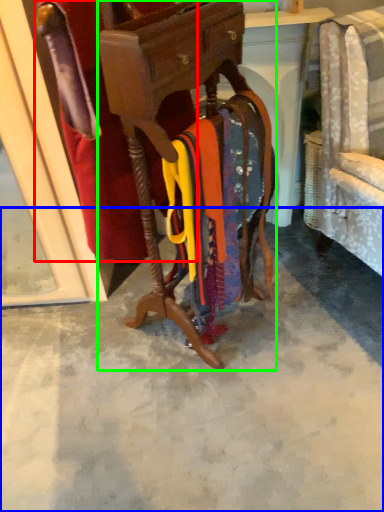
Question: Which is nearer to the robe (highlighted by a red box)? concrete (highlighted by a blue box) or furniture (highlighted by a green box).

Choices:
 (A) concrete
 (B) furniture

Answer: (B)